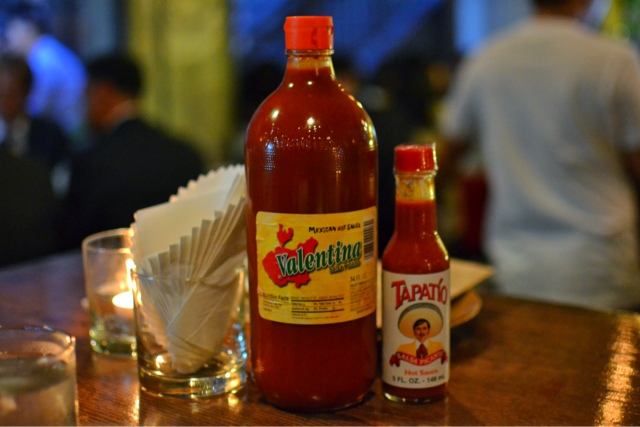
The width and height of the screenshot is (640, 427). What are the coordinates of `napkins in glasses` in the screenshot? It's located at (202, 246).